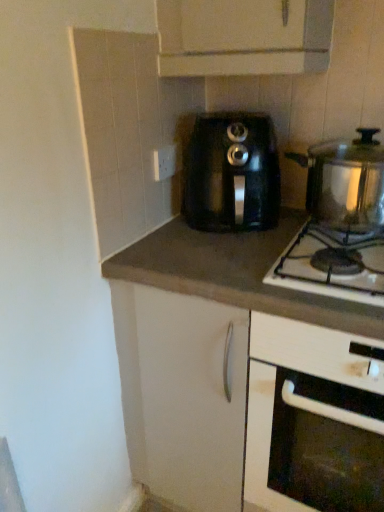
Question: Can you confirm if white plastic electric outlet at upper center is taller than black plastic coffee maker at center, which is counted as the 1th kitchen appliance, starting from the left?

Choices:
 (A) yes
 (B) no

Answer: (B)

Question: Is white plastic electric outlet at upper center oriented towards black plastic coffee maker at center, placed as the second kitchen appliance when sorted from right to left?

Choices:
 (A) yes
 (B) no

Answer: (A)

Question: Is white plastic electric outlet at upper center wider than black plastic coffee maker at center, placed as the second kitchen appliance when sorted from right to left?

Choices:
 (A) no
 (B) yes

Answer: (A)

Question: Considering the relative sizes of white plastic electric outlet at upper center and black plastic coffee maker at center, which is counted as the 1th kitchen appliance, starting from the left, in the image provided, is white plastic electric outlet at upper center shorter than black plastic coffee maker at center, which is counted as the 1th kitchen appliance, starting from the left,?

Choices:
 (A) yes
 (B) no

Answer: (A)

Question: From a real-world perspective, does white plastic electric outlet at upper center stand above black plastic coffee maker at center, which is counted as the 1th kitchen appliance, starting from the left?

Choices:
 (A) no
 (B) yes

Answer: (B)

Question: In the image, is satin silver pot at right, the 2th kitchen appliance from the left, positioned in front of or behind stainless steel gas stove at right?

Choices:
 (A) front
 (B) behind

Answer: (B)

Question: In the image, is satin silver pot at right, the 2th kitchen appliance from the left, on the left side or the right side of stainless steel gas stove at right?

Choices:
 (A) left
 (B) right

Answer: (B)

Question: Considering the positions of satin silver pot at right, the 2th kitchen appliance from the left, and stainless steel gas stove at right in the image, is satin silver pot at right, the 2th kitchen appliance from the left, bigger or smaller than stainless steel gas stove at right?

Choices:
 (A) small
 (B) big

Answer: (B)

Question: Considering the positions of satin silver pot at right, the 2th kitchen appliance from the left, and stainless steel gas stove at right in the image, is satin silver pot at right, the 2th kitchen appliance from the left, wider or thinner than stainless steel gas stove at right?

Choices:
 (A) thin
 (B) wide

Answer: (A)

Question: Based on their positions, is white plastic electric outlet at upper center located to the left or right of matte gray countertop at center?

Choices:
 (A) right
 (B) left

Answer: (B)

Question: Is point (152, 165) closer or farther from the camera than point (104, 275)?

Choices:
 (A) farther
 (B) closer

Answer: (A)

Question: From a real-world perspective, is white plastic electric outlet at upper center above or below matte gray countertop at center?

Choices:
 (A) below
 (B) above

Answer: (B)

Question: From their relative heights in the image, would you say white plastic electric outlet at upper center is taller or shorter than matte gray countertop at center?

Choices:
 (A) short
 (B) tall

Answer: (A)

Question: Relative to matte gray countertop at center, is black plastic coffee maker at center, placed as the second kitchen appliance when sorted from right to left, in front or behind?

Choices:
 (A) behind
 (B) front

Answer: (A)

Question: Is black plastic coffee maker at center, which is counted as the 1th kitchen appliance, starting from the left, bigger or smaller than matte gray countertop at center?

Choices:
 (A) big
 (B) small

Answer: (B)